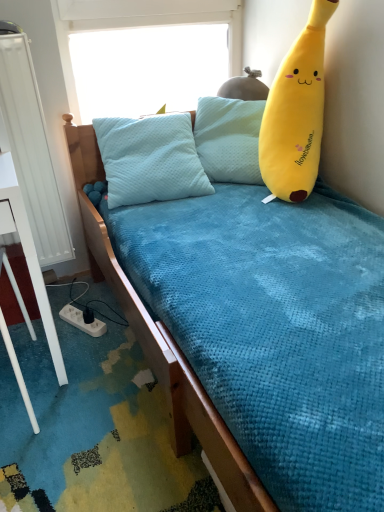
At what (x,y) coordinates should I click in order to perform the action: click on empty space that is to the right of white plastic power outlet at lower left. Please return your answer as a coordinate pair (x, y). Looking at the image, I should click on (115, 334).